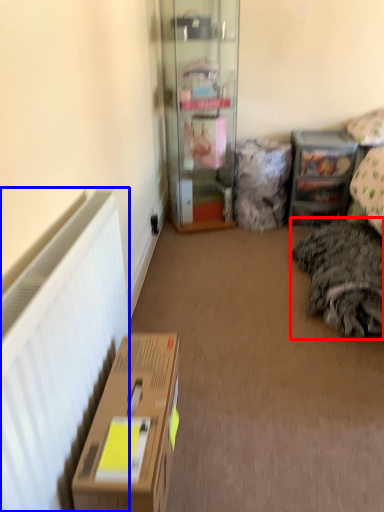
Question: Among these objects, which one is nearest to the camera, bedding (highlighted by a red box) or radiator (highlighted by a blue box)?

Choices:
 (A) bedding
 (B) radiator

Answer: (B)